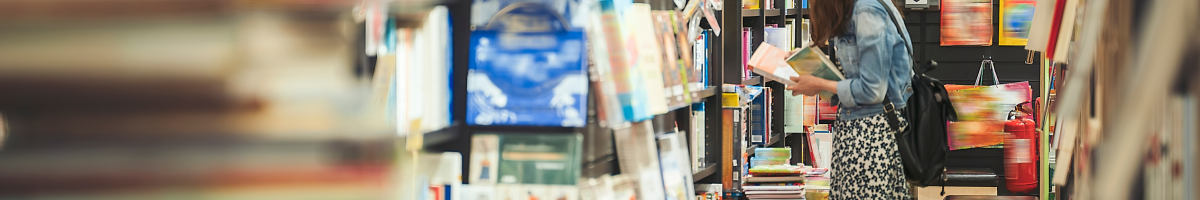
Locate an element on the screen. books is located at coordinates tap(504, 73), tap(422, 67), tap(654, 51), tap(772, 7), tap(769, 68), tap(780, 169).